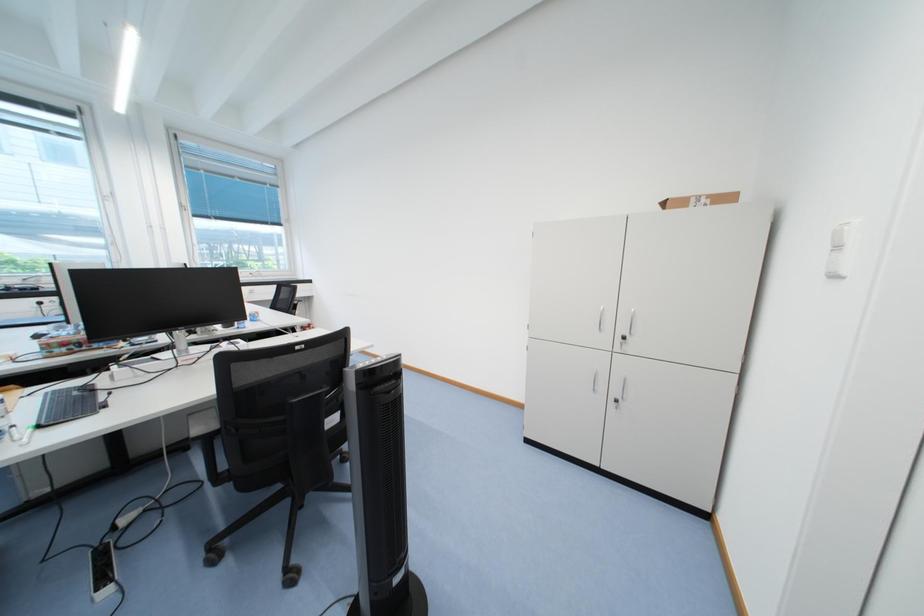
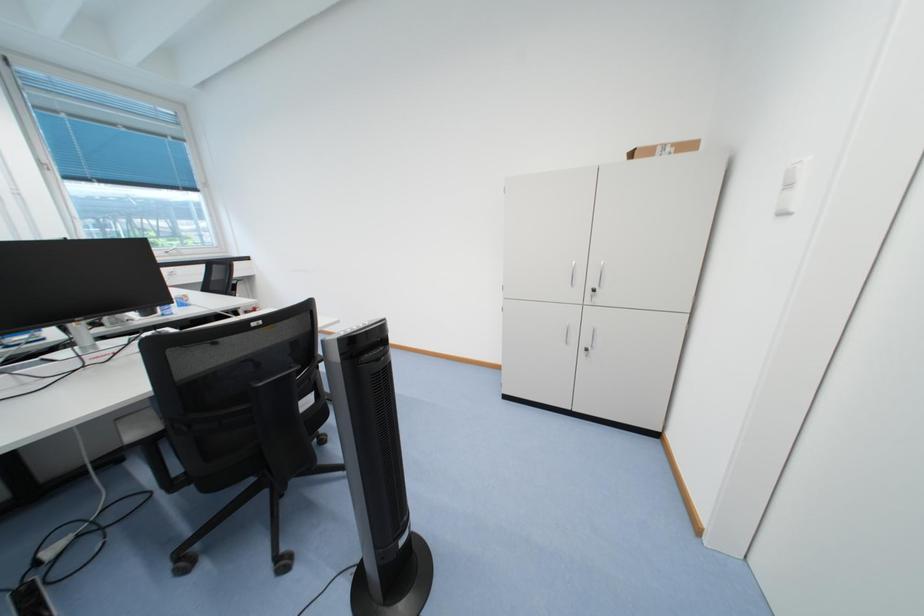
Question: The first image is from the beginning of the video and the second image is from the end. How did the camera likely rotate when shooting the video?

Choices:
 (A) Left
 (B) Right
 (C) Up
 (D) Down

Answer: (B)